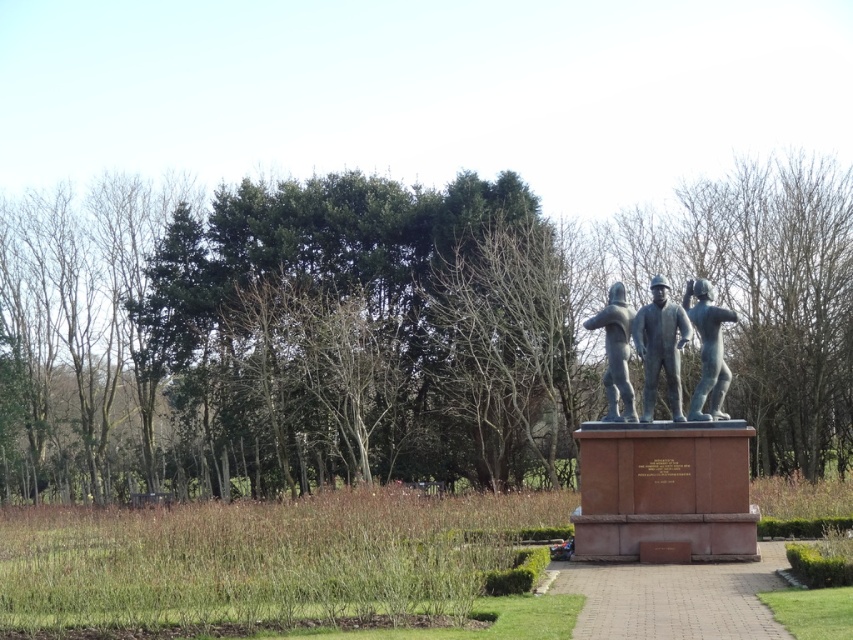
You are standing at the start of the paved pathway leading to the statue. You want to take a photo of the statue with the green leafy tree at center in the background. Which direction should you face to ensure the tree is behind the statue in your photo?

You should face towards the statue so that the green leafy tree at center, located at point (393, 330), is positioned behind the statue in your photo.

You are standing on the paved pathway leading to the statue. You see the green leafy tree at center and the polished silver statue at center. Which object is located to the left of the other?

The green leafy tree at center is positioned on the left side of polished silver statue at center.